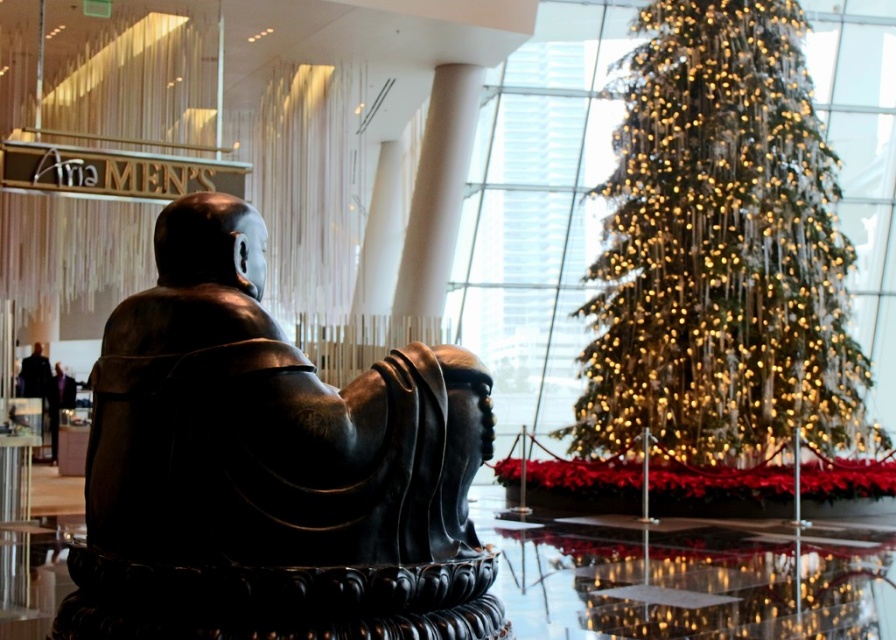
Based on the photo, can you confirm if bronze statue at left is shorter than iridescent gold lights at center?

Yes.

Is bronze statue at left closer to the viewer compared to iridescent gold lights at center?

Yes, it is.

In the scene shown: Who is more distant from viewer, [478,602] or [819,166]?

The point [819,166] is behind.

Identify the location of bronze statue at left. Image resolution: width=896 pixels, height=640 pixels. (270, 468).